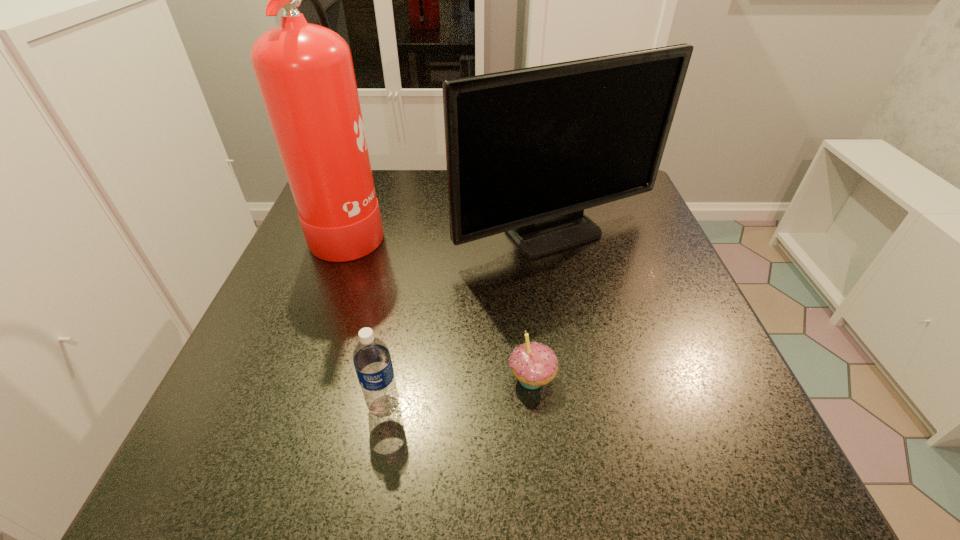
I want to click on fire extinguisher, so click(x=305, y=74).

Where is `the leftmost object`? This screenshot has height=540, width=960. the leftmost object is located at coordinates (305, 74).

Image resolution: width=960 pixels, height=540 pixels. In order to click on computer monitor in this screenshot , I will do `click(527, 150)`.

Locate an element on the screen. The width and height of the screenshot is (960, 540). water bottle is located at coordinates (371, 357).

Locate an element on the screen. This screenshot has width=960, height=540. the second shortest object is located at coordinates (371, 357).

At what (x,y) coordinates should I click in order to perform the action: click on the shortest object. Please return your answer as a coordinate pair (x, y). The width and height of the screenshot is (960, 540). Looking at the image, I should click on (533, 364).

The height and width of the screenshot is (540, 960). Identify the location of free region located 0.320m towards the nozzle of the leftmost object. click(525, 227).

Locate an element on the screen. This screenshot has width=960, height=540. free spot located 0.380m on the front-facing side of the third shortest object is located at coordinates (601, 442).

Locate an element on the screen. free point located 0.120m on the right of the water bottle is located at coordinates (479, 406).

Where is `vacant space situated on the right of the cupcake`? vacant space situated on the right of the cupcake is located at coordinates (660, 379).